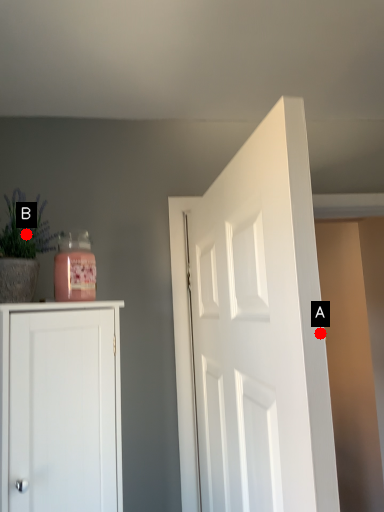
Question: Two points are circled on the image, labeled by A and B beside each circle. Which point appears farthest from the camera in this image?

Choices:
 (A) A is further
 (B) B is further

Answer: (B)